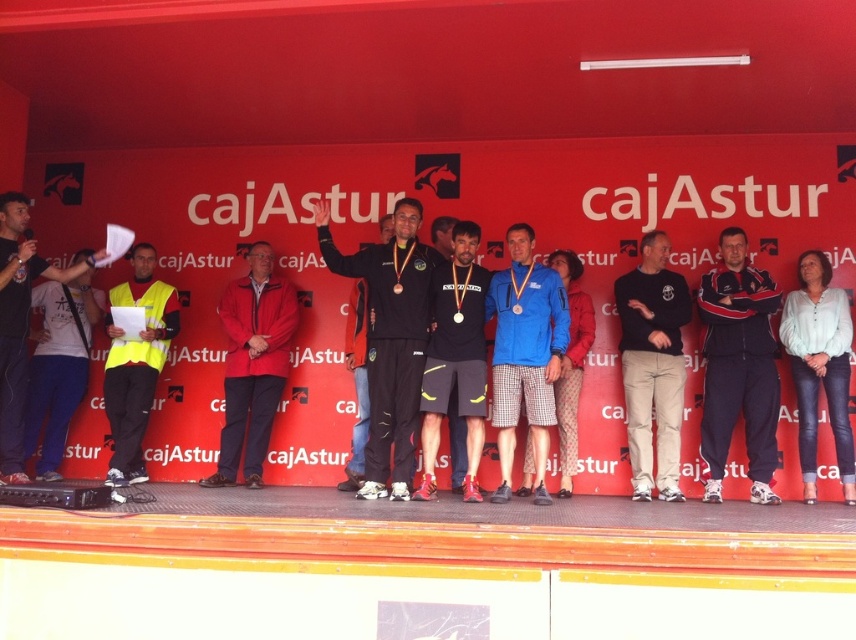
You are a photographer positioned at the back of the stage. You need to capture a clear photo of both the matte black tracksuit at center and the black cotton pants at center. Which one will appear bigger in the photo?

The matte black tracksuit at center will appear bigger in the photo because it is larger in size than the black cotton pants at center.